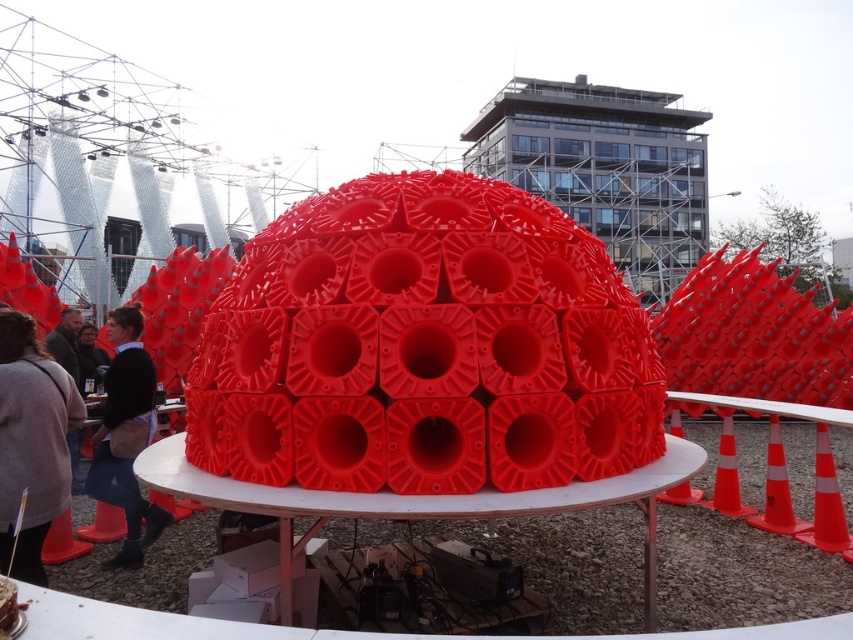
Who is higher up, orange plastic cone at right or matte black jacket at center?

matte black jacket at center is higher up.

Is orange plastic cone at right wider than matte black jacket at center?

No, orange plastic cone at right is not wider than matte black jacket at center.

This screenshot has height=640, width=853. Find the location of `orange plastic cone at right`. orange plastic cone at right is located at coordinates (727, 474).

You are a GUI agent. You are given a task and a screenshot of the screen. Output one action in this format:
    pyautogui.click(x=<x>, y=<y>)
    Task: Click on the orange plastic cone at right
    The image size is (853, 640).
    Given the screenshot: What is the action you would take?
    pyautogui.click(x=727, y=474)

Is denim jacket at lower left closer to the viewer compared to orange reflective cone at center?

Yes, denim jacket at lower left is closer to the viewer.

Is point (146, 401) positioned after point (825, 515)?

No, it is not.

Is point (111, 564) farther from camera compared to point (834, 552)?

No, it is not.

The image size is (853, 640). Identify the location of denim jacket at lower left. (126, 436).

This screenshot has height=640, width=853. What do you see at coordinates (32, 444) in the screenshot?
I see `gray sweater at lower left` at bounding box center [32, 444].

Who is positioned more to the right, gray sweater at lower left or orange reflective cone at lower right?

orange reflective cone at lower right

Is point (10, 448) positioned in front of point (778, 419)?

Yes, it is in front of point (778, 419).

What are the coordinates of `gray sweater at lower left` in the screenshot? It's located at (32, 444).